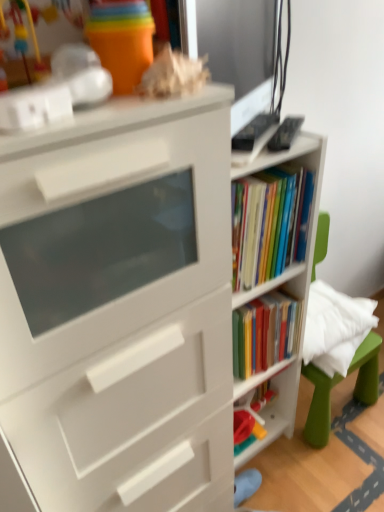
Question: Is point (33, 465) positioned closer to the camera than point (266, 425)?

Choices:
 (A) farther
 (B) closer

Answer: (B)

Question: Is white matte bookcase at center inside or outside of plastic toy at center, which ranks as the 2th shelf in top-to-bottom order?

Choices:
 (A) inside
 (B) outside

Answer: (B)

Question: Which object is positioned closest to the green plastic swivel chair at right?

Choices:
 (A) white matte bookshelf at center, marked as the 1th shelf in a top-to-bottom arrangement
 (B) white matte bookcase at center
 (C) matte black monitor at upper right
 (D) plastic toy at center, arranged as the 1th shelf when ordered from the bottom

Answer: (D)

Question: Which object is the closest to the green plastic swivel chair at right?

Choices:
 (A) matte black monitor at upper right
 (B) white matte bookshelf at center, marked as the 1th shelf in a top-to-bottom arrangement
 (C) plastic toy at center, which ranks as the 2th shelf in top-to-bottom order
 (D) white matte bookcase at center

Answer: (C)